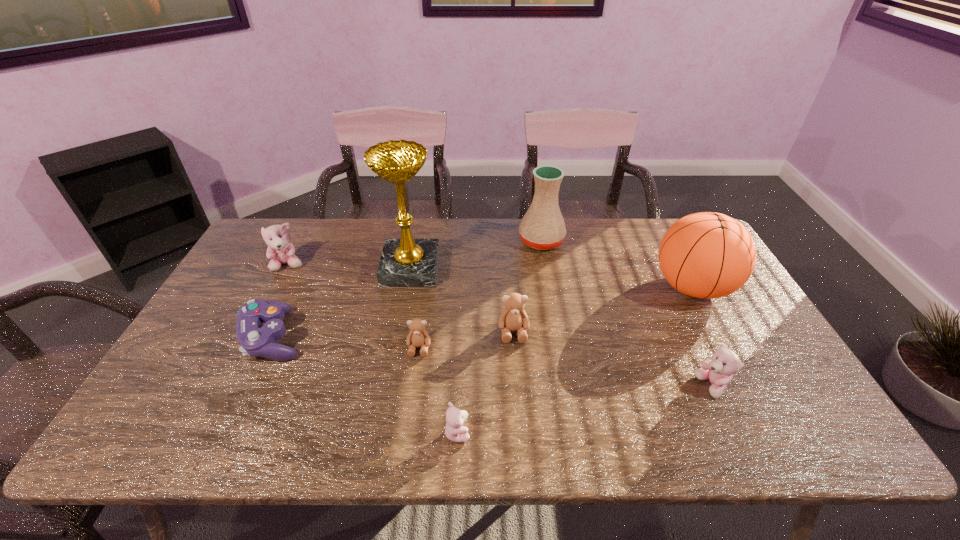
I want to click on gold award, so click(x=406, y=262).

Find the location of a particular element. This screenshot has width=960, height=540. the tallest object is located at coordinates (406, 262).

At what (x,y) coordinates should I click in order to perform the action: click on pottery. Please return your answer as a coordinate pair (x, y). The width and height of the screenshot is (960, 540). Looking at the image, I should click on (542, 227).

This screenshot has height=540, width=960. In order to click on basketball in this screenshot , I will do `click(707, 255)`.

In order to click on the leftmost pink teddy bear in this screenshot , I will do `click(280, 251)`.

Where is `the tallest teddy bear`? the tallest teddy bear is located at coordinates (280, 251).

Where is `the second teddy bear from right to left`? The height and width of the screenshot is (540, 960). the second teddy bear from right to left is located at coordinates tap(513, 318).

Find the location of a particular element. the right brown teddy bear is located at coordinates (513, 318).

In order to click on the rightmost teddy bear in this screenshot , I will do `click(719, 370)`.

The height and width of the screenshot is (540, 960). What are the coordinates of `the second nearest teddy bear` in the screenshot? It's located at 719,370.